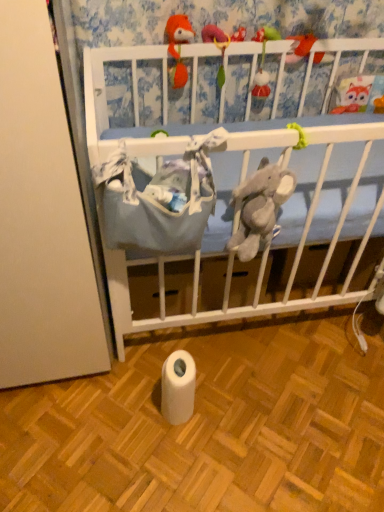
Identify the location of vacant space to the left of white matte toilet paper at lower center. The width and height of the screenshot is (384, 512). (126, 411).